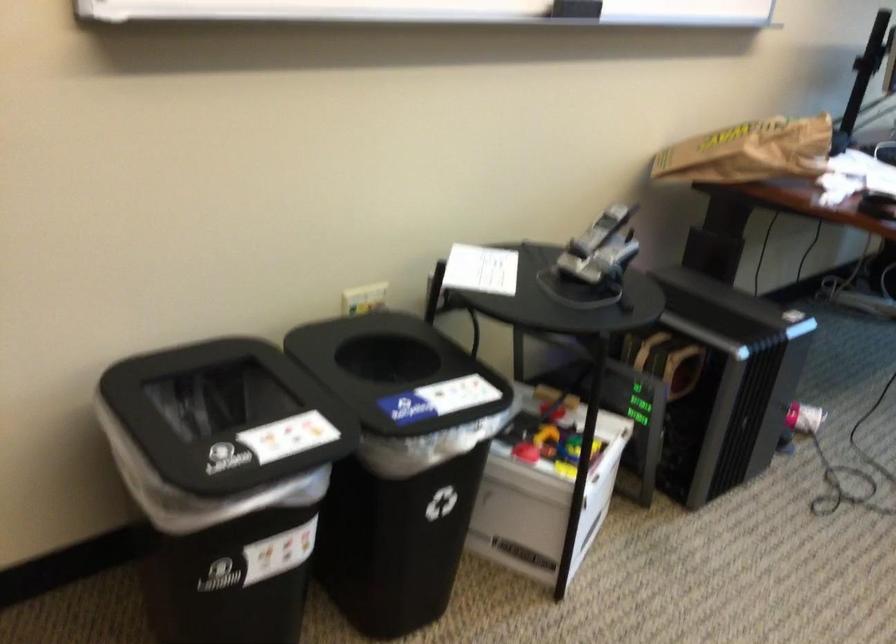
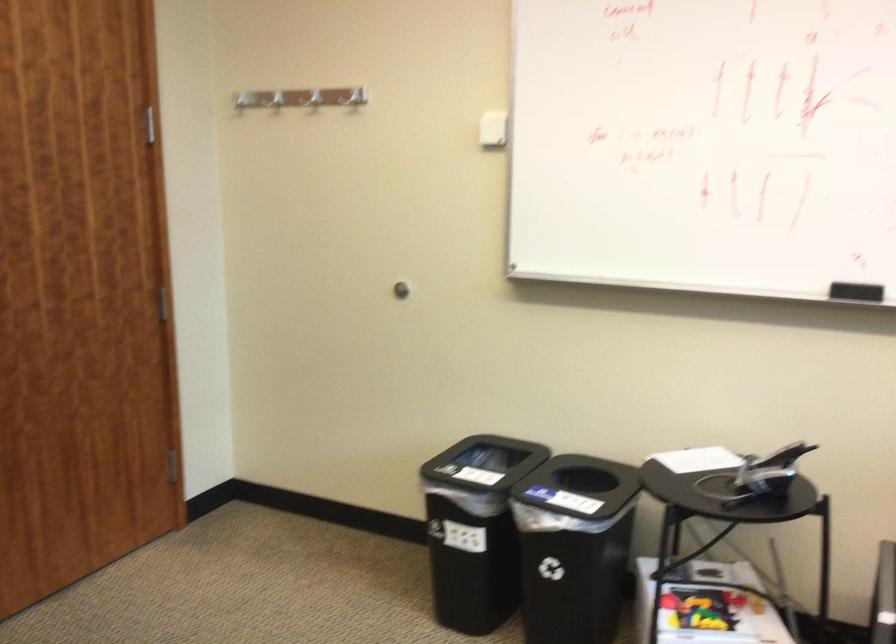
The point at (476, 453) is marked in the first image. Where is the corresponding point in the second image?

(574, 547)